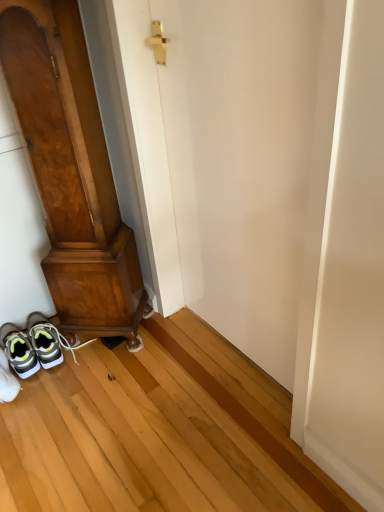
What do you see at coordinates (71, 170) in the screenshot? I see `wooden door at left, the second door in the right-to-left sequence` at bounding box center [71, 170].

Where is `white matte sneakers at lower left, which ranks as the 2th footwear in front-to-back order`? The height and width of the screenshot is (512, 384). white matte sneakers at lower left, which ranks as the 2th footwear in front-to-back order is located at coordinates (34, 345).

Describe the element at coordinates (34, 345) in the screenshot. I see `white matte sneakers at lower left, which is counted as the 1th footwear, starting from the back` at that location.

You are a GUI agent. You are given a task and a screenshot of the screen. Output one action in this format:
    pyautogui.click(x=<x>, y=<y>)
    Task: Click on the wooden door at left, the second door in the right-to-left sequence
    
    Given the screenshot: What is the action you would take?
    pyautogui.click(x=71, y=170)

In the scene shown: Considering the sizes of white matte sneakers at lower left, which ranks as the 2th footwear in front-to-back order, and wooden door at left, the second door in the right-to-left sequence, in the image, is white matte sneakers at lower left, which ranks as the 2th footwear in front-to-back order, wider or thinner than wooden door at left, the second door in the right-to-left sequence,?

Clearly, white matte sneakers at lower left, which ranks as the 2th footwear in front-to-back order, has more width compared to wooden door at left, the second door in the right-to-left sequence.

Considering the sizes of objects white matte sneakers at lower left, which ranks as the 2th footwear in front-to-back order, and wooden door at left, the first door from the left, in the image provided, who is shorter, white matte sneakers at lower left, which ranks as the 2th footwear in front-to-back order, or wooden door at left, the first door from the left,?

Standing shorter between the two is white matte sneakers at lower left, which ranks as the 2th footwear in front-to-back order.

Looking at this image, is white matte sneakers at lower left, which is counted as the 1th footwear, starting from the back, placed right next to wooden door at left, the first door from the left?

No.

Is white matte sneakers at lower left, which ranks as the 2th footwear in front-to-back order, bigger or smaller than wooden door at left, the second door in the right-to-left sequence?

Clearly, white matte sneakers at lower left, which ranks as the 2th footwear in front-to-back order, is smaller in size than wooden door at left, the second door in the right-to-left sequence.

Which object is closer to the camera taking this photo, wooden door at left, the second door in the right-to-left sequence, or white mesh sneakers at lower left, marked as the 2th footwear in a back-to-front arrangement?

wooden door at left, the second door in the right-to-left sequence, is more forward.

Can you confirm if wooden door at left, the first door from the left, is smaller than white mesh sneakers at lower left, marked as the 1th footwear in a front-to-back arrangement?

Actually, wooden door at left, the first door from the left, might be larger than white mesh sneakers at lower left, marked as the 1th footwear in a front-to-back arrangement.

Which object is positioned more to the right, wooden door at left, the first door from the left, or white mesh sneakers at lower left, marked as the 1th footwear in a front-to-back arrangement?

wooden door at left, the first door from the left, is more to the right.

Is white mesh sneakers at lower left, marked as the 1th footwear in a front-to-back arrangement, inside wooden door at left, the second door in the right-to-left sequence?

No, wooden door at left, the second door in the right-to-left sequence, does not contain white mesh sneakers at lower left, marked as the 1th footwear in a front-to-back arrangement.

Between white mesh sneakers at lower left, marked as the 1th footwear in a front-to-back arrangement, and wooden door at left, the second door in the right-to-left sequence, which one has more height?

Standing taller between the two is wooden door at left, the second door in the right-to-left sequence.

Considering the relative positions of white mesh sneakers at lower left, marked as the 2th footwear in a back-to-front arrangement, and wooden door at left, the second door in the right-to-left sequence, in the image provided, is white mesh sneakers at lower left, marked as the 2th footwear in a back-to-front arrangement, to the right of wooden door at left, the second door in the right-to-left sequence, from the viewer's perspective?

Incorrect, white mesh sneakers at lower left, marked as the 2th footwear in a back-to-front arrangement, is not on the right side of wooden door at left, the second door in the right-to-left sequence.

From the picture: What's the angular difference between white mesh sneakers at lower left, marked as the 2th footwear in a back-to-front arrangement, and wooden door at left, the second door in the right-to-left sequence,'s facing directions?

The angular difference between white mesh sneakers at lower left, marked as the 2th footwear in a back-to-front arrangement, and wooden door at left, the second door in the right-to-left sequence, is 38.1 degrees.

From the image's perspective, which is below, white smooth door at center, which ranks as the 2th door in left-to-right order, or white mesh sneakers at lower left, marked as the 1th footwear in a front-to-back arrangement?

From the image's view, white mesh sneakers at lower left, marked as the 1th footwear in a front-to-back arrangement, is below.

Can you confirm if white smooth door at center, which ranks as the 1th door in right-to-left order, is positioned to the left of white mesh sneakers at lower left, marked as the 1th footwear in a front-to-back arrangement?

No.

Is white smooth door at center, which ranks as the 2th door in left-to-right order, aimed at white mesh sneakers at lower left, marked as the 1th footwear in a front-to-back arrangement?

Yes, white smooth door at center, which ranks as the 2th door in left-to-right order, faces towards white mesh sneakers at lower left, marked as the 1th footwear in a front-to-back arrangement.

Is white smooth door at center, which ranks as the 1th door in right-to-left order, closer to the viewer compared to white matte sneakers at lower left, which is counted as the 1th footwear, starting from the back?

Yes, it is.

Does white smooth door at center, which ranks as the 1th door in right-to-left order, have a smaller size compared to white matte sneakers at lower left, which ranks as the 2th footwear in front-to-back order?

No, white smooth door at center, which ranks as the 1th door in right-to-left order, is not smaller than white matte sneakers at lower left, which ranks as the 2th footwear in front-to-back order.

Does point (237, 89) come behind point (2, 341)?

That is False.

Considering the relative sizes of white mesh sneakers at lower left, marked as the 2th footwear in a back-to-front arrangement, and white smooth door at center, which ranks as the 1th door in right-to-left order, in the image provided, is white mesh sneakers at lower left, marked as the 2th footwear in a back-to-front arrangement, shorter than white smooth door at center, which ranks as the 1th door in right-to-left order,?

Indeed, white mesh sneakers at lower left, marked as the 2th footwear in a back-to-front arrangement, has a lesser height compared to white smooth door at center, which ranks as the 1th door in right-to-left order.

Between white mesh sneakers at lower left, marked as the 2th footwear in a back-to-front arrangement, and white smooth door at center, which ranks as the 1th door in right-to-left order, which one appears on the left side from the viewer's perspective?

white mesh sneakers at lower left, marked as the 2th footwear in a back-to-front arrangement, is more to the left.

Is white mesh sneakers at lower left, marked as the 2th footwear in a back-to-front arrangement, not near white smooth door at center, which ranks as the 1th door in right-to-left order?

That's not correct — white mesh sneakers at lower left, marked as the 2th footwear in a back-to-front arrangement, is a little close to white smooth door at center, which ranks as the 1th door in right-to-left order.

Based on the photo, how much distance is there between white mesh sneakers at lower left, marked as the 2th footwear in a back-to-front arrangement, and white smooth door at center, which ranks as the 1th door in right-to-left order?

The distance of white mesh sneakers at lower left, marked as the 2th footwear in a back-to-front arrangement, from white smooth door at center, which ranks as the 1th door in right-to-left order, is 38.80 inches.

Considering the sizes of objects wooden door at left, the first door from the left, and white matte sneakers at lower left, which is counted as the 1th footwear, starting from the back, in the image provided, who is wider, wooden door at left, the first door from the left, or white matte sneakers at lower left, which is counted as the 1th footwear, starting from the back,?

white matte sneakers at lower left, which is counted as the 1th footwear, starting from the back.

Based on their positions, is wooden door at left, the first door from the left, located to the left or right of white matte sneakers at lower left, which is counted as the 1th footwear, starting from the back?

wooden door at left, the first door from the left, is to the right of white matte sneakers at lower left, which is counted as the 1th footwear, starting from the back.

Is wooden door at left, the second door in the right-to-left sequence, not within white matte sneakers at lower left, which ranks as the 2th footwear in front-to-back order?

wooden door at left, the second door in the right-to-left sequence, is positioned outside white matte sneakers at lower left, which ranks as the 2th footwear in front-to-back order.

From the image's perspective, count 2nd doors upward from the white matte sneakers at lower left, which ranks as the 2th footwear in front-to-back order, and point to it. Please provide its 2D coordinates.

[(71, 170)]

From a real-world perspective, starting from the wooden door at left, the second door in the right-to-left sequence, which footwear is the 1st one below it? Please provide its 2D coordinates.

[(7, 381)]

Estimate the real-world distances between objects in this image. Which object is closer to white mesh sneakers at lower left, marked as the 2th footwear in a back-to-front arrangement, white smooth door at center, which ranks as the 1th door in right-to-left order, or wooden door at left, the first door from the left?

wooden door at left, the first door from the left.

Which object lies nearer to the anchor point white smooth door at center, which ranks as the 1th door in right-to-left order, white matte sneakers at lower left, which ranks as the 2th footwear in front-to-back order, or white mesh sneakers at lower left, marked as the 1th footwear in a front-to-back arrangement?

white matte sneakers at lower left, which ranks as the 2th footwear in front-to-back order.

Looking at the image, which one is located closer to white mesh sneakers at lower left, marked as the 1th footwear in a front-to-back arrangement, wooden door at left, the first door from the left, or white matte sneakers at lower left, which ranks as the 2th footwear in front-to-back order?

Based on the image, white matte sneakers at lower left, which ranks as the 2th footwear in front-to-back order, appears to be nearer to white mesh sneakers at lower left, marked as the 1th footwear in a front-to-back arrangement.

Which object lies further to the anchor point white smooth door at center, which ranks as the 2th door in left-to-right order, wooden door at left, the second door in the right-to-left sequence, or white matte sneakers at lower left, which is counted as the 1th footwear, starting from the back?

white matte sneakers at lower left, which is counted as the 1th footwear, starting from the back.

When comparing their distances from wooden door at left, the second door in the right-to-left sequence, does white matte sneakers at lower left, which ranks as the 2th footwear in front-to-back order, or white smooth door at center, which ranks as the 2th door in left-to-right order, seem further?

white matte sneakers at lower left, which ranks as the 2th footwear in front-to-back order.

When comparing their distances from white smooth door at center, which ranks as the 2th door in left-to-right order, does wooden door at left, the second door in the right-to-left sequence, or white mesh sneakers at lower left, marked as the 2th footwear in a back-to-front arrangement, seem closer?

wooden door at left, the second door in the right-to-left sequence, lies closer to white smooth door at center, which ranks as the 2th door in left-to-right order, than the other object.

From the image, which object appears to be farther from white matte sneakers at lower left, which is counted as the 1th footwear, starting from the back, wooden door at left, the second door in the right-to-left sequence, or white mesh sneakers at lower left, marked as the 1th footwear in a front-to-back arrangement?

Among the two, wooden door at left, the second door in the right-to-left sequence, is located further to white matte sneakers at lower left, which is counted as the 1th footwear, starting from the back.

Based on their spatial positions, is white matte sneakers at lower left, which is counted as the 1th footwear, starting from the back, or white mesh sneakers at lower left, marked as the 2th footwear in a back-to-front arrangement, further from wooden door at left, the second door in the right-to-left sequence?

Based on the image, white mesh sneakers at lower left, marked as the 2th footwear in a back-to-front arrangement, appears to be further to wooden door at left, the second door in the right-to-left sequence.

Where is `door situated between white mesh sneakers at lower left, marked as the 1th footwear in a front-to-back arrangement, and white smooth door at center, which ranks as the 2th door in left-to-right order, from left to right`? The height and width of the screenshot is (512, 384). door situated between white mesh sneakers at lower left, marked as the 1th footwear in a front-to-back arrangement, and white smooth door at center, which ranks as the 2th door in left-to-right order, from left to right is located at coordinates (71, 170).

Find the location of a particular element. The image size is (384, 512). footwear between white mesh sneakers at lower left, marked as the 2th footwear in a back-to-front arrangement, and white smooth door at center, which ranks as the 2th door in left-to-right order, in the horizontal direction is located at coordinates (34, 345).

Where is `door between white smooth door at center, which ranks as the 2th door in left-to-right order, and white matte sneakers at lower left, which ranks as the 2th footwear in front-to-back order, in the front-back direction`? door between white smooth door at center, which ranks as the 2th door in left-to-right order, and white matte sneakers at lower left, which ranks as the 2th footwear in front-to-back order, in the front-back direction is located at coordinates (71, 170).

The width and height of the screenshot is (384, 512). In order to click on footwear between wooden door at left, the first door from the left, and white mesh sneakers at lower left, marked as the 2th footwear in a back-to-front arrangement, in the vertical direction in this screenshot , I will do `click(34, 345)`.